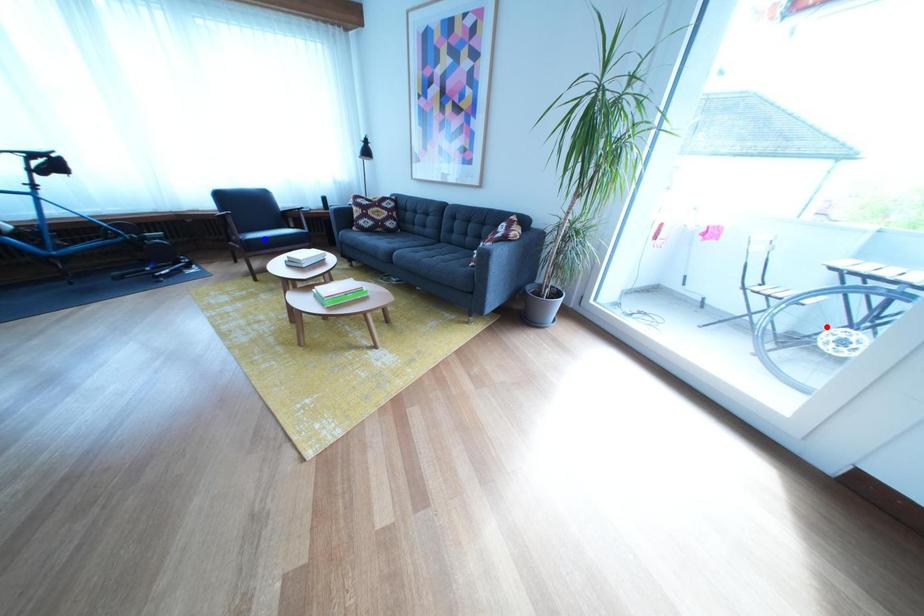
Question: In the image, two points are highlighted. Which point is nearer to the camera? Reply with the corresponding letter.

Choices:
 (A) blue point
 (B) red point

Answer: (B)